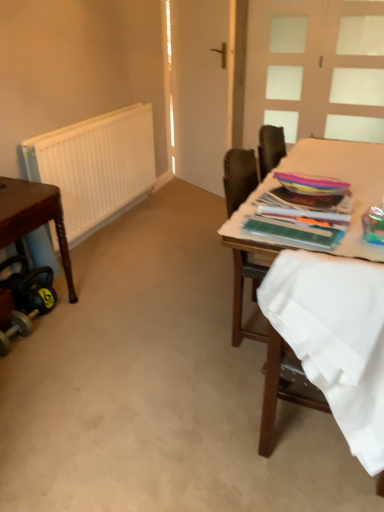
Question: In the image, is white matte radiator at left positioned in front of or behind brown wooden table at left?

Choices:
 (A) behind
 (B) front

Answer: (A)

Question: In terms of size, does white matte radiator at left appear bigger or smaller than brown wooden table at left?

Choices:
 (A) big
 (B) small

Answer: (B)

Question: Considering the real-world distances, which object is closest to the white frosted glass door at upper right?

Choices:
 (A) brown wooden table at left
 (B) wooden chair at right
 (C) white fabric at right
 (D) wooden table at right
 (E) white matte barn door at center

Answer: (E)

Question: Considering the real-world distances, which object is farthest from the white frosted glass door at upper right?

Choices:
 (A) white matte barn door at center
 (B) wooden chair at right
 (C) wooden table at right
 (D) white matte radiator at left
 (E) white fabric at right

Answer: (E)